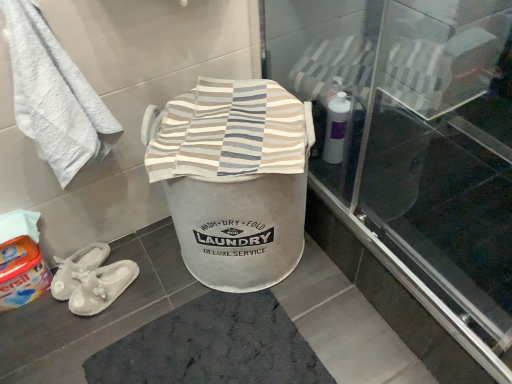
Question: Can you confirm if white soft towel at upper left is positioned to the left of orange fabric detergent at lower left?

Choices:
 (A) yes
 (B) no

Answer: (B)

Question: Is orange fabric detergent at lower left surrounded by white soft towel at upper left?

Choices:
 (A) yes
 (B) no

Answer: (B)

Question: From a real-world perspective, is white soft towel at upper left under orange fabric detergent at lower left?

Choices:
 (A) no
 (B) yes

Answer: (A)

Question: From the image's perspective, is white soft towel at upper left over orange fabric detergent at lower left?

Choices:
 (A) yes
 (B) no

Answer: (A)

Question: From a real-world perspective, is white soft towel at upper left located higher than orange fabric detergent at lower left?

Choices:
 (A) no
 (B) yes

Answer: (B)

Question: Is dark gray textured bath mat at center inside or outside of white fabric slippers at lower left?

Choices:
 (A) inside
 (B) outside

Answer: (B)

Question: Considering the positions of dark gray textured bath mat at center and white fabric slippers at lower left in the image, is dark gray textured bath mat at center wider or thinner than white fabric slippers at lower left?

Choices:
 (A) wide
 (B) thin

Answer: (A)

Question: In terms of size, does dark gray textured bath mat at center appear bigger or smaller than white fabric slippers at lower left?

Choices:
 (A) big
 (B) small

Answer: (A)

Question: Is point (305, 367) positioned closer to the camera than point (81, 304)?

Choices:
 (A) farther
 (B) closer

Answer: (B)

Question: In the image, is dark gray textured bath mat at center positioned in front of or behind orange fabric detergent at lower left?

Choices:
 (A) front
 (B) behind

Answer: (A)

Question: From a real-world perspective, is dark gray textured bath mat at center positioned above or below orange fabric detergent at lower left?

Choices:
 (A) above
 (B) below

Answer: (B)

Question: From their relative heights in the image, would you say dark gray textured bath mat at center is taller or shorter than orange fabric detergent at lower left?

Choices:
 (A) tall
 (B) short

Answer: (B)

Question: Is dark gray textured bath mat at center inside the boundaries of orange fabric detergent at lower left, or outside?

Choices:
 (A) inside
 (B) outside

Answer: (B)

Question: From a real-world perspective, relative to white fabric slippers at lower left, is transparent glass screen door at upper center vertically above or below?

Choices:
 (A) below
 (B) above

Answer: (B)

Question: Is transparent glass screen door at upper center taller or shorter than white fabric slippers at lower left?

Choices:
 (A) tall
 (B) short

Answer: (A)